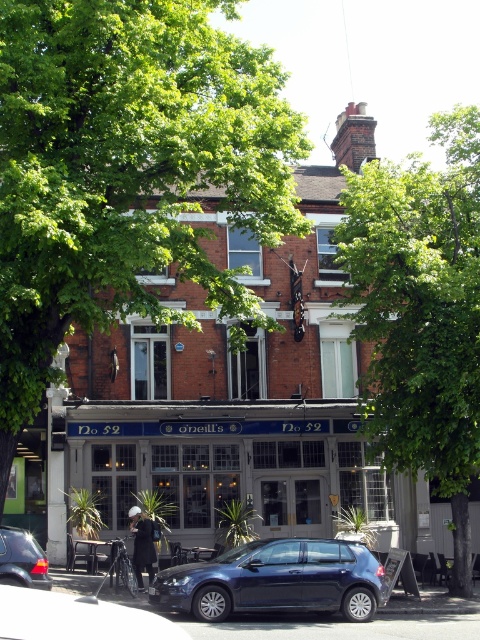
You are standing at the entrance of the brick building at center. If you look towards the direction of the dark car parked on the curb, which object would you see first?

The dark car parked on the curb is partially obscuring the view of the sidewalk, so you would see the dark car parked on the curb first before the sidewalk.

You are a delivery person who needs to park your 2.5 meter wide delivery van between the brick building at center and the glossy metallic hatchback at lower center. Is there enough space for your van to fit between them?

The brick building at center and glossy metallic hatchback at lower center are 7.59 meters apart from each other. Since your delivery van is 2.5 meters wide, there is sufficient space between them to park your van.

You are a delivery person arriving at No 52 O Neill s. You need to park your vehicle behind the brick building at center so it won t block the sidewalk. Is the glossy metallic hatchback at lower center currently blocking your parking spot?

The glossy metallic hatchback at lower center is behind the brick building at center, so it is occupying the parking spot behind the brick building at center. Therefore, the glossy metallic hatchback at lower center is blocking your parking spot.